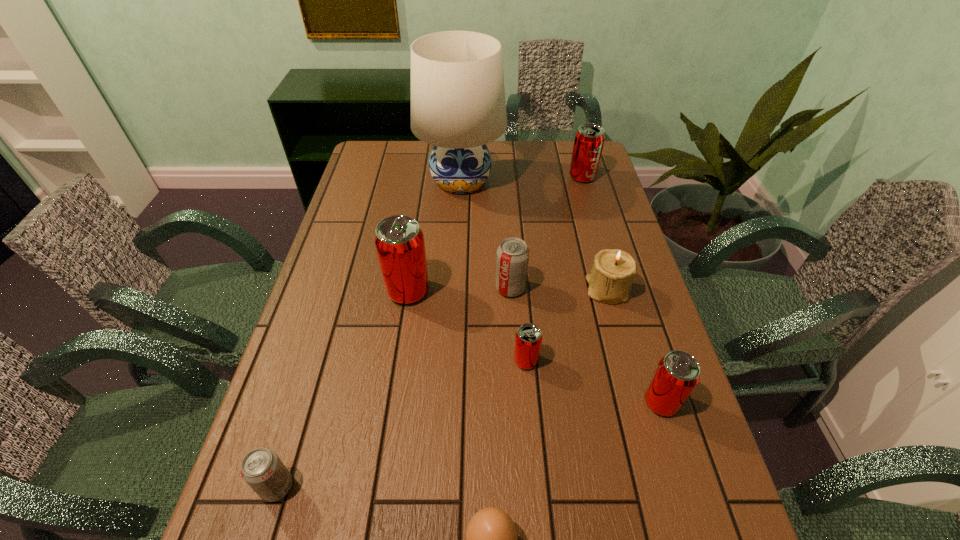
Where is `soda can that is the third nearest to the smallest red soda can`? soda can that is the third nearest to the smallest red soda can is located at coordinates (399, 241).

The image size is (960, 540). Find the location of `soda can that stands as the closest to the brown boiled egg`. soda can that stands as the closest to the brown boiled egg is located at coordinates (528, 340).

Identify which red soda can is the closest to the farthest soda can. Please provide its 2D coordinates. Your answer should be formatted as a tuple, i.e. [(x, y)], where the tuple contains the x and y coordinates of a point satisfying the conditions above.

[(399, 241)]

Locate which red soda can ranks second in proximity to the leftmost red soda can. Please provide its 2D coordinates. Your answer should be formatted as a tuple, i.e. [(x, y)], where the tuple contains the x and y coordinates of a point satisfying the conditions above.

[(677, 373)]

This screenshot has height=540, width=960. I want to click on vacant region that satisfies the following two spatial constraints: 1. on the back side of the leftmost object; 2. on the left side of the farthest red soda can, so click(x=372, y=177).

I want to click on free region that satisfies the following two spatial constraints: 1. on the back side of the second farthest red soda can; 2. on the left side of the leftmost soda can, so click(337, 291).

Identify the location of vacant area that satisfies the following two spatial constraints: 1. on the back side of the third farthest red soda can; 2. on the left side of the candle_holder. (519, 289).

The image size is (960, 540). Identify the location of free space that satisfies the following two spatial constraints: 1. on the front-facing side of the beige candle_holder; 2. on the left side of the lampshade. (455, 289).